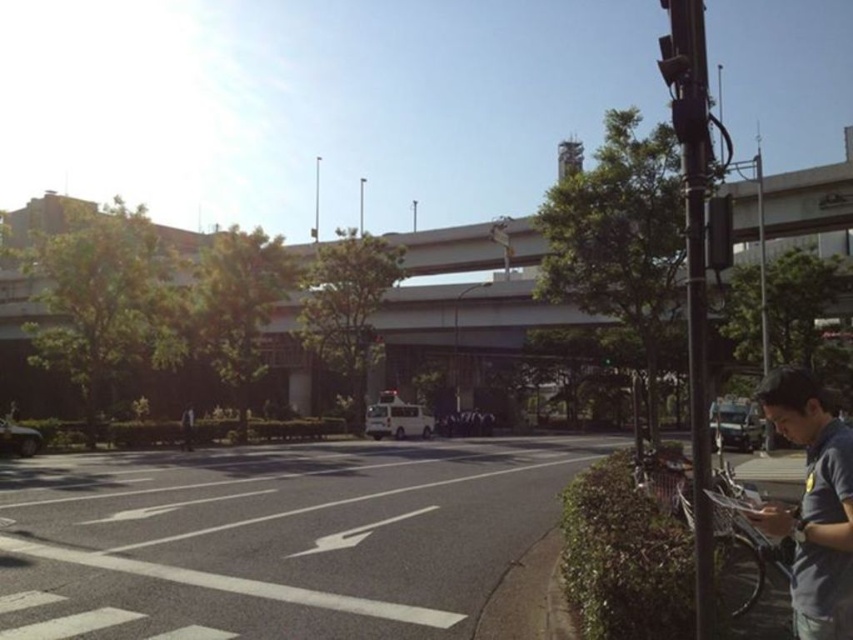
You are a delivery drone flying over an urban street. You need to land on the white asphalt road at center. However, there is a dark gray shirt at center in the way. Based on their relative heights, can you safely land on the road without hitting the shirt?

The white asphalt road at center is not as tall as dark gray shirt at center, meaning the shirt is taller. Since the shirt is taller, the drone cannot safely land on the road without the risk of collision with the shirt.